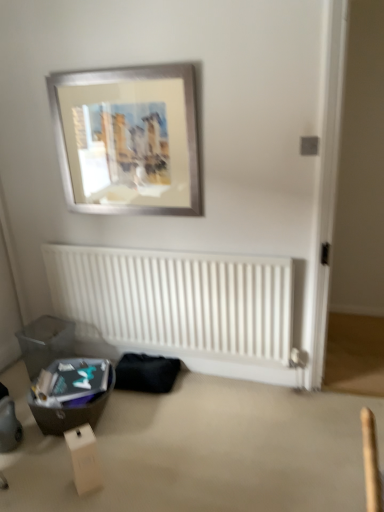
Question: Is white cardboard box at lower left taller than white matte radiator at lower center?

Choices:
 (A) yes
 (B) no

Answer: (B)

Question: Is white cardboard box at lower left at the right side of white matte radiator at lower center?

Choices:
 (A) no
 (B) yes

Answer: (A)

Question: Is white cardboard box at lower left not within white matte radiator at lower center?

Choices:
 (A) yes
 (B) no

Answer: (A)

Question: Is white cardboard box at lower left smaller than white matte radiator at lower center?

Choices:
 (A) yes
 (B) no

Answer: (A)

Question: Is white cardboard box at lower left surrounding white matte radiator at lower center?

Choices:
 (A) no
 (B) yes

Answer: (A)

Question: Do you think matte black storage box at lower left, marked as the 1th storage box in a front-to-back arrangement, is within white matte radiator at lower center, or outside of it?

Choices:
 (A) outside
 (B) inside

Answer: (A)

Question: Based on their sizes in the image, would you say matte black storage box at lower left, which is the second storage box from back to front, is bigger or smaller than white matte radiator at lower center?

Choices:
 (A) big
 (B) small

Answer: (B)

Question: Considering the positions of point (41, 411) and point (59, 261), is point (41, 411) closer or farther from the camera than point (59, 261)?

Choices:
 (A) farther
 (B) closer

Answer: (B)

Question: Considering the positions of matte black storage box at lower left, which is the second storage box from back to front, and white matte radiator at lower center in the image, is matte black storage box at lower left, which is the second storage box from back to front, taller or shorter than white matte radiator at lower center?

Choices:
 (A) tall
 (B) short

Answer: (B)

Question: Considering the positions of silver metallic picture frame at upper center and white cardboard box at lower left in the image, is silver metallic picture frame at upper center bigger or smaller than white cardboard box at lower left?

Choices:
 (A) small
 (B) big

Answer: (B)

Question: Is silver metallic picture frame at upper center to the left or to the right of white cardboard box at lower left in the image?

Choices:
 (A) right
 (B) left

Answer: (A)

Question: In terms of height, does silver metallic picture frame at upper center look taller or shorter compared to white cardboard box at lower left?

Choices:
 (A) tall
 (B) short

Answer: (A)

Question: From the image's perspective, is silver metallic picture frame at upper center positioned above or below white cardboard box at lower left?

Choices:
 (A) below
 (B) above

Answer: (B)

Question: Do you think white matte radiator at lower center is within silver metallic picture frame at upper center, or outside of it?

Choices:
 (A) inside
 (B) outside

Answer: (B)

Question: Based on their positions, is white matte radiator at lower center located to the left or right of silver metallic picture frame at upper center?

Choices:
 (A) left
 (B) right

Answer: (B)